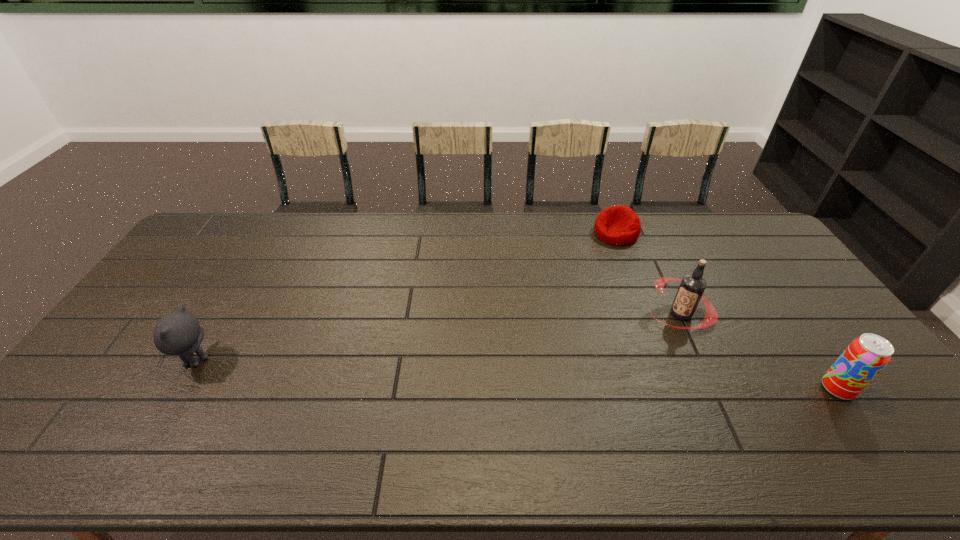
Locate an element on the screen. vacant space situated 0.060m on the label of the root beer is located at coordinates 644,334.

The height and width of the screenshot is (540, 960). Find the location of `vacant region located 0.240m on the label of the root beer`. vacant region located 0.240m on the label of the root beer is located at coordinates (601, 364).

The width and height of the screenshot is (960, 540). I want to click on blank area located on the seat area of the beanbag, so click(569, 307).

Locate an element on the screen. vacant area situated 0.350m on the seat area of the beanbag is located at coordinates (571, 305).

This screenshot has height=540, width=960. Find the location of `free spot located on the seat area of the beanbag`. free spot located on the seat area of the beanbag is located at coordinates coord(588,279).

Find the location of `object at the far edge`. object at the far edge is located at coordinates (619, 225).

Find the location of `object located at the near edge`. object located at the near edge is located at coordinates (865, 357).

This screenshot has width=960, height=540. In order to click on object that is at the right edge in this screenshot , I will do point(865,357).

Image resolution: width=960 pixels, height=540 pixels. In order to click on object positioned at the near right corner in this screenshot , I will do `click(865, 357)`.

In the image, there is a desktop. In order to click on vacant space at the far edge in this screenshot , I will do `click(557, 248)`.